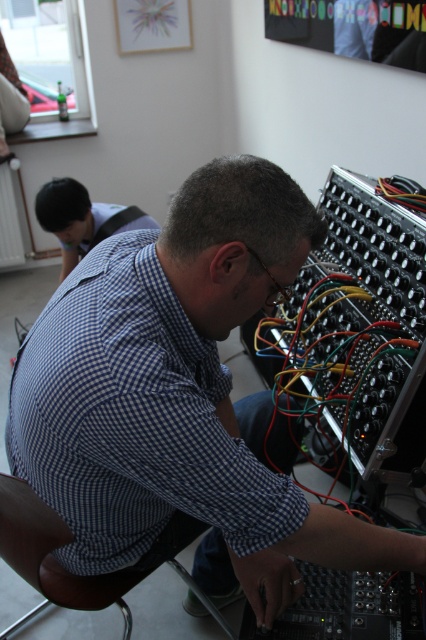
Is blue checkered shirt at center thinner than brown leather chair at lower left?

No.

Does blue checkered shirt at center appear over brown leather chair at lower left?

Yes, blue checkered shirt at center is above brown leather chair at lower left.

Does point (175, 422) come behind point (40, 531)?

No.

The width and height of the screenshot is (426, 640). Find the location of `blue checkered shirt at center`. blue checkered shirt at center is located at coordinates (175, 406).

Is blue checkered shirt at center thinner than blue checkered shirt at upper left?

Incorrect, blue checkered shirt at center's width is not less than blue checkered shirt at upper left's.

Is blue checkered shirt at center below blue checkered shirt at upper left?

Correct, blue checkered shirt at center is located below blue checkered shirt at upper left.

What are the coordinates of `blue checkered shirt at center` in the screenshot? It's located at (175, 406).

Which is below, brown leather chair at lower left or blue checkered shirt at upper left?

brown leather chair at lower left is lower down.

Does brown leather chair at lower left appear over blue checkered shirt at upper left?

No.

You are a GUI agent. You are given a task and a screenshot of the screen. Output one action in this format:
    pyautogui.click(x=<x>, y=<y>)
    Task: Click on the brown leather chair at lower left
    
    Given the screenshot: What is the action you would take?
    pyautogui.click(x=51, y=552)